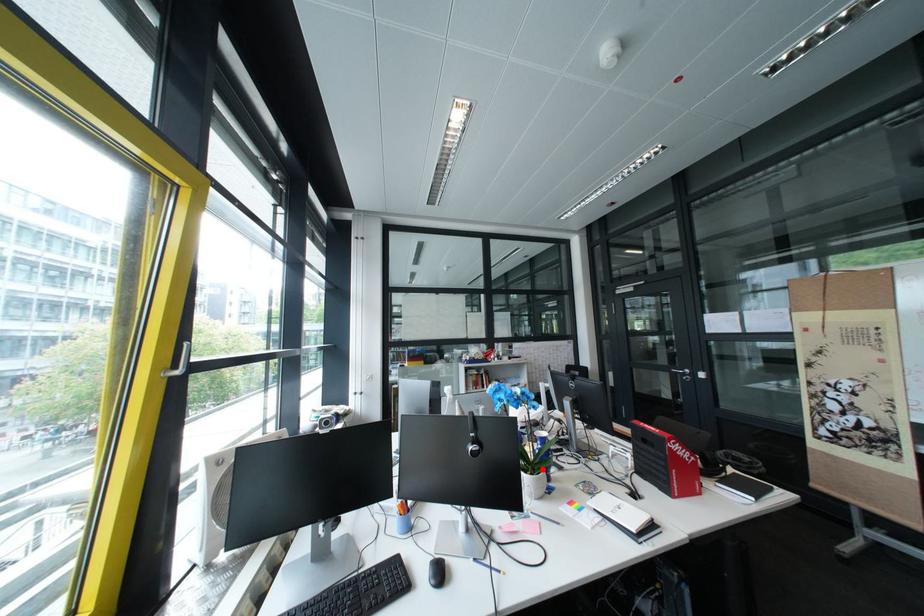
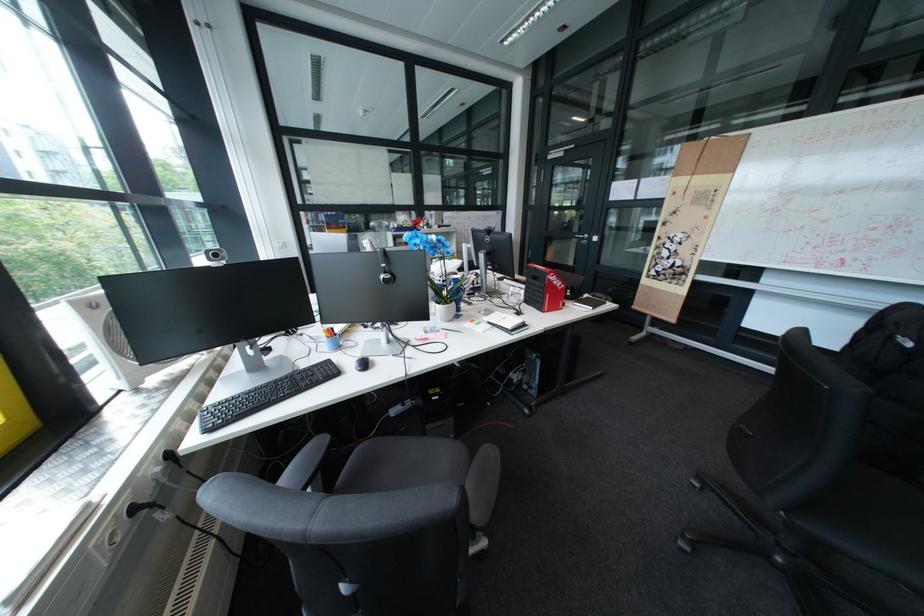
Where in the second image is the point corresponding to the highlighted location from the first image?

(456, 302)